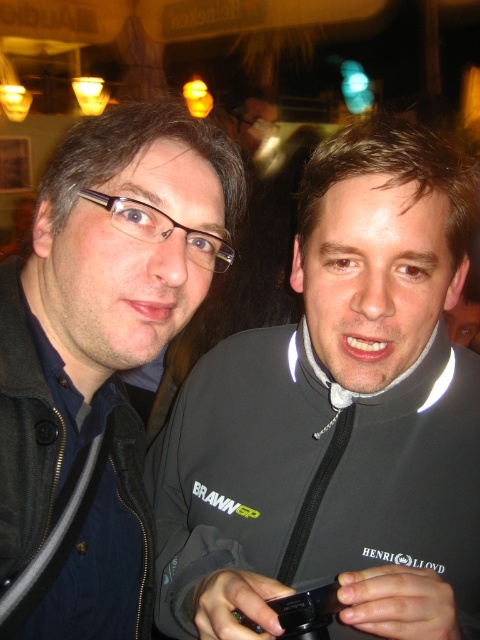
You are a photographer trying to capture a candid shot of the two people in the scene. You have a matte black jacket at left and a black plastic smartphone at center in your viewfinder. Which object should you focus on if you want to capture something taller in the frame?

The matte black jacket at left is taller than the black plastic smartphone at center, so you should focus on the matte black jacket at left to capture something taller in the frame.

Based on the photo, you are a photographer trying to capture a group photo of two people wearing black jackets. You need to ensure there is at least 8 inches of space between them for proper framing. Based on the scene, can you determine if the black matte jacket at center and the matte black jacket at left are positioned far enough apart?

The distance between the black matte jacket at center and the matte black jacket at left is 6.87 inches, which is less than the required 8 inches. Therefore, they are not positioned far enough apart for proper framing.

You are taking a photo of two people in a bar. The matte black jacket at left and the black plastic smartphone at center are in the scene. Which object is higher up in the frame?

The matte black jacket at left is located above the black plastic smartphone at center, so it is higher up in the frame.